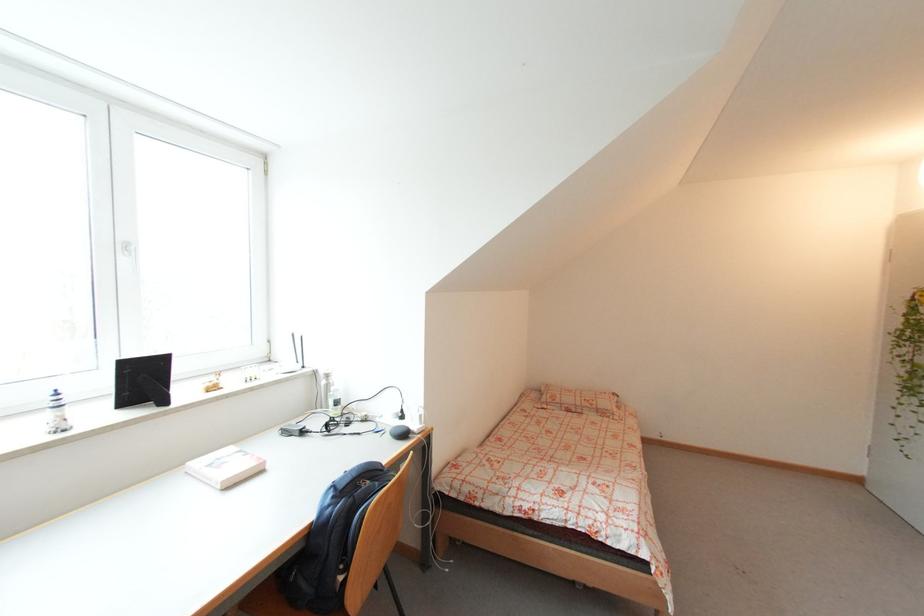
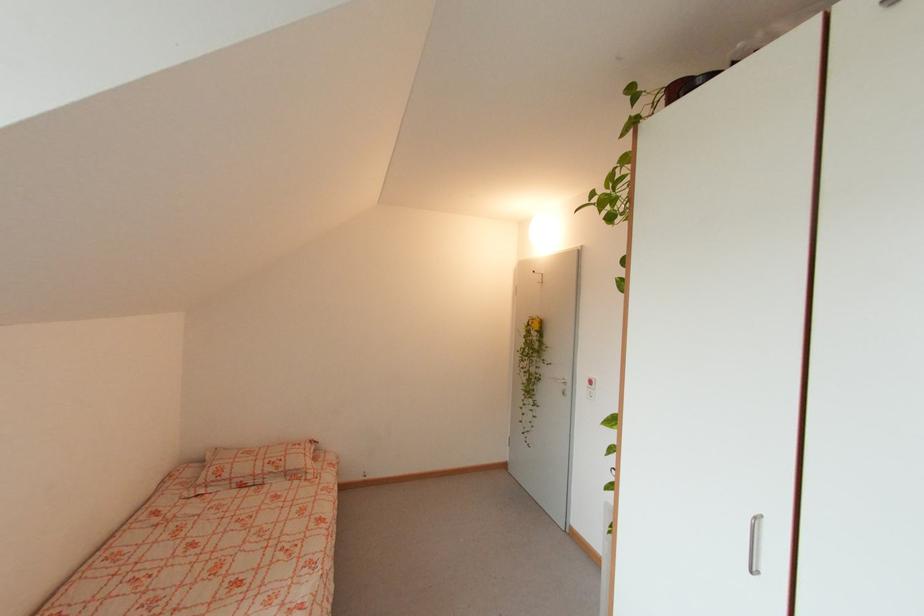
In the second image, find the point that corresponds to (x=555, y=405) in the first image.

(219, 484)